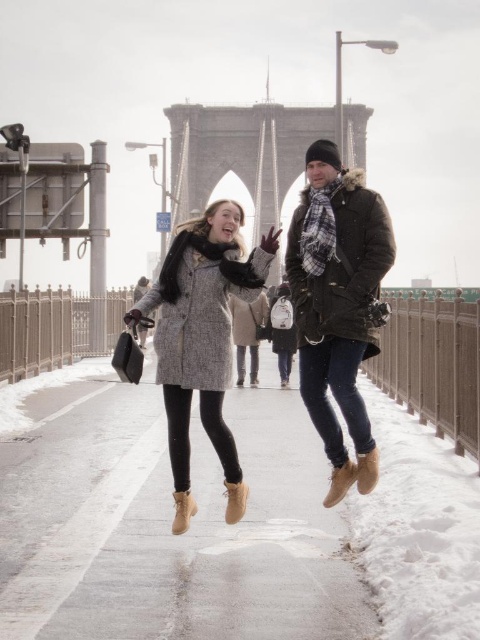
Which is in front, point (113, 600) or point (177, 390)?

Point (113, 600)

Is smooth concrete pavement at center below textured gray coat at center?

Correct, smooth concrete pavement at center is located below textured gray coat at center.

The height and width of the screenshot is (640, 480). Describe the element at coordinates (223, 522) in the screenshot. I see `smooth concrete pavement at center` at that location.

Identify the location of smooth concrete pavement at center. This screenshot has width=480, height=640. click(223, 522).

Which is in front, point (345, 387) or point (267, 243)?

Point (345, 387)

Is brown woolen coat at center positioned before textured gray coat at center?

No.

I want to click on brown woolen coat at center, so click(337, 305).

Is smooth concrete pavement at center closer to the viewer compared to matte gray coat at center?

Yes.

Is point (48, 428) in front of point (355, 234)?

No, it is not.

Find the location of a particular element. The image size is (480, 640). smooth concrete pavement at center is located at coordinates (223, 522).